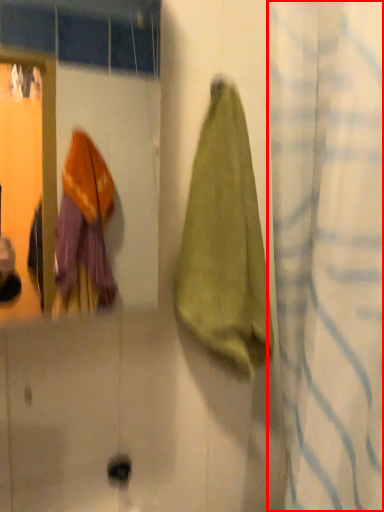
Question: From the image's perspective, where is curtain (annotated by the red box) located relative to towel?

Choices:
 (A) below
 (B) above

Answer: (A)